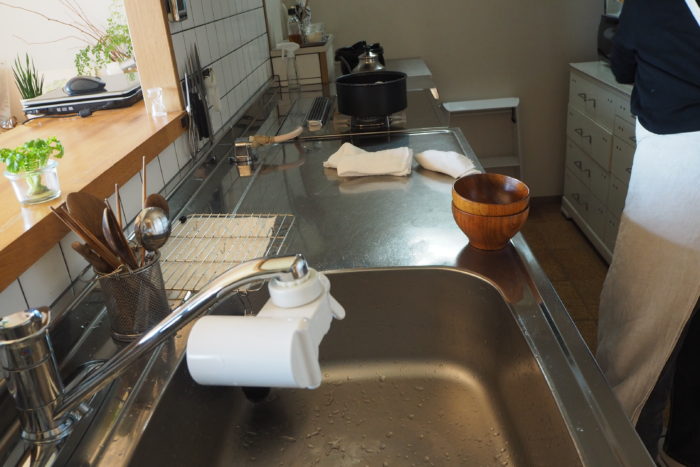
You are a GUI agent. You are given a task and a screenshot of the screen. Output one action in this format:
    pyautogui.click(x=<x>, y=<y>)
    Task: Click on the stainless steel sink
    
    Given the screenshot: What is the action you would take?
    pyautogui.click(x=399, y=358)